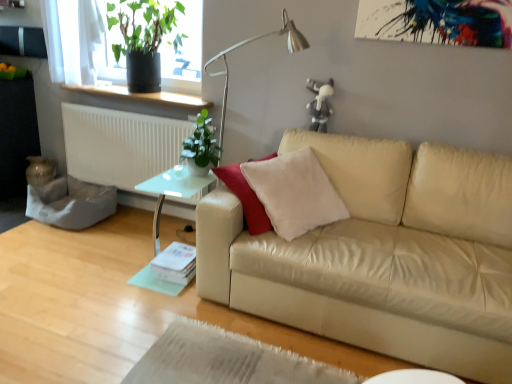
Question: From a real-world perspective, is beige leather couch at center beneath white plastic radiator at left?

Choices:
 (A) no
 (B) yes

Answer: (B)

Question: Does beige leather couch at center have a larger size compared to white plastic radiator at left?

Choices:
 (A) no
 (B) yes

Answer: (B)

Question: Is beige leather couch at center to the left of white plastic radiator at left from the viewer's perspective?

Choices:
 (A) no
 (B) yes

Answer: (A)

Question: Considering the relative sizes of beige leather couch at center and white plastic radiator at left in the image provided, is beige leather couch at center shorter than white plastic radiator at left?

Choices:
 (A) yes
 (B) no

Answer: (B)

Question: From a real-world perspective, is beige leather couch at center over white plastic radiator at left?

Choices:
 (A) no
 (B) yes

Answer: (A)

Question: Can you confirm if beige leather couch at center is wider than white plastic radiator at left?

Choices:
 (A) no
 (B) yes

Answer: (B)

Question: Is white plastic radiator at left placed right next to metallic silver table lamp at upper center?

Choices:
 (A) yes
 (B) no

Answer: (B)

Question: Is white plastic radiator at left completely or partially outside of metallic silver table lamp at upper center?

Choices:
 (A) no
 (B) yes

Answer: (B)

Question: Would you say white plastic radiator at left contains metallic silver table lamp at upper center?

Choices:
 (A) yes
 (B) no

Answer: (B)

Question: Is white plastic radiator at left at the left side of metallic silver table lamp at upper center?

Choices:
 (A) yes
 (B) no

Answer: (A)

Question: Does white plastic radiator at left have a greater width compared to metallic silver table lamp at upper center?

Choices:
 (A) no
 (B) yes

Answer: (A)

Question: Considering the relative sizes of white plastic radiator at left and metallic silver table lamp at upper center in the image provided, is white plastic radiator at left taller than metallic silver table lamp at upper center?

Choices:
 (A) no
 (B) yes

Answer: (A)

Question: Is green glossy plant at upper left, arranged as the 1th houseplant when ordered from the bottom, shorter than metallic silver table lamp at upper center?

Choices:
 (A) no
 (B) yes

Answer: (B)